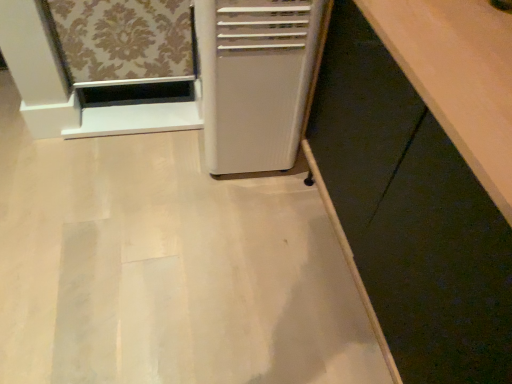
Question: From the image's perspective, is white plastic air conditioner at center above or below matte white cabinet at lower right?

Choices:
 (A) below
 (B) above

Answer: (B)

Question: From a real-world perspective, is white plastic air conditioner at center physically located above or below matte white cabinet at lower right?

Choices:
 (A) above
 (B) below

Answer: (B)

Question: Relative to matte white cabinet at lower right, is white plastic air conditioner at center in front or behind?

Choices:
 (A) behind
 (B) front

Answer: (A)

Question: Does point (445, 350) appear closer or farther from the camera than point (253, 87)?

Choices:
 (A) closer
 (B) farther

Answer: (A)

Question: Visually, is matte white cabinet at lower right positioned to the left or to the right of white plastic air conditioner at center?

Choices:
 (A) left
 (B) right

Answer: (B)

Question: From a real-world perspective, is matte white cabinet at lower right positioned above or below white plastic air conditioner at center?

Choices:
 (A) below
 (B) above

Answer: (B)

Question: Considering the positions of matte white cabinet at lower right and white plastic air conditioner at center in the image, is matte white cabinet at lower right taller or shorter than white plastic air conditioner at center?

Choices:
 (A) tall
 (B) short

Answer: (A)